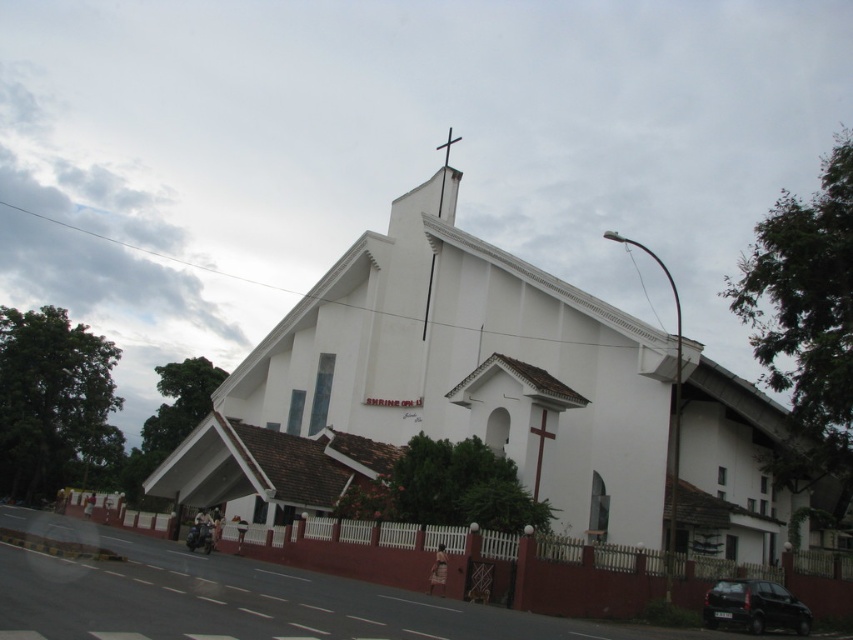
You are standing in front of the modern white church and want to determine the relative positions of two points on the building. The first point is located at coordinates point (x=752, y=600) and the second at point (x=445, y=145). Which point is nearer to your current position?

Point (x=752, y=600) is closer to the viewer than point (x=445, y=145).

Consider the image. You are an architect designing a new church and want to ensure the cross on the roof is visible from a distance. Given that the white smooth cross at upper center and the white wooden cross at upper center are both present, which cross would you recommend using based on their size?

The white wooden cross at upper center is wider than the white smooth cross at upper center, so it would be more visible from a distance.

You are a photographer standing at the edge of the road, wanting to capture both the white smooth church at center and the black matte car at lower right in a single shot. Based on their heights, which object will appear taller in your photo?

The white smooth church at center will appear taller in the photo because it has a greater height compared to the black matte car at lower right.